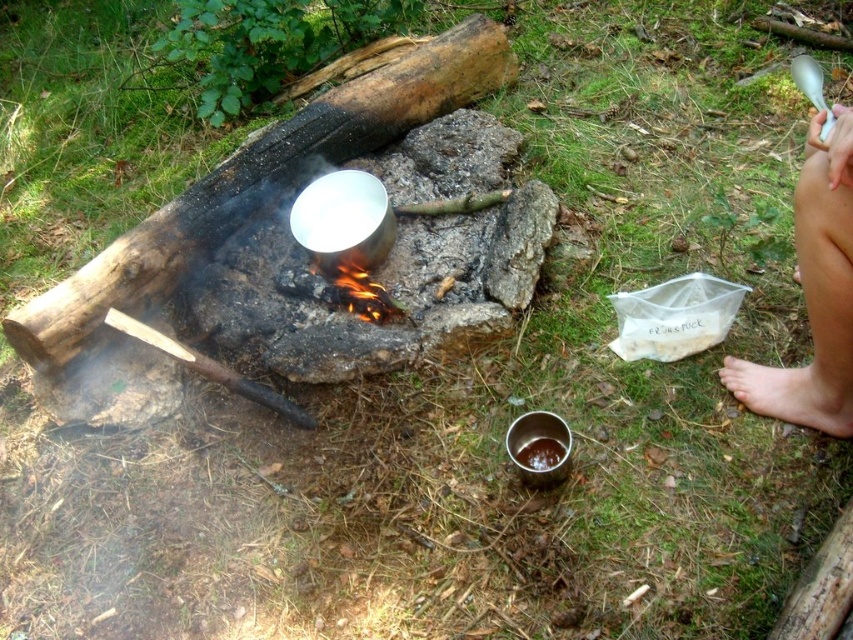
Question: Is bare skin leg at right to the left of bare skin at lower right from the viewer's perspective?

Choices:
 (A) no
 (B) yes

Answer: (B)

Question: Which point is closer to the camera taking this photo?

Choices:
 (A) (839, 232)
 (B) (849, 435)

Answer: (A)

Question: Does bare skin leg at right appear on the right side of bare skin at lower right?

Choices:
 (A) no
 (B) yes

Answer: (A)

Question: Which point is closer to the camera taking this photo?

Choices:
 (A) (809, 264)
 (B) (811, 392)

Answer: (A)

Question: Does bare skin leg at right have a smaller size compared to bare skin at lower right?

Choices:
 (A) yes
 (B) no

Answer: (B)